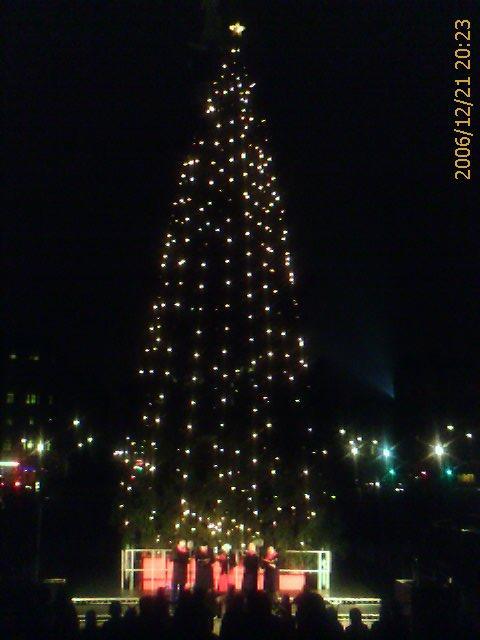
This screenshot has height=640, width=480. In order to click on windows in this screenshot , I will do `click(10, 396)`, `click(30, 397)`, `click(14, 355)`, `click(34, 354)`, `click(31, 442)`, `click(48, 443)`, `click(6, 448)`.